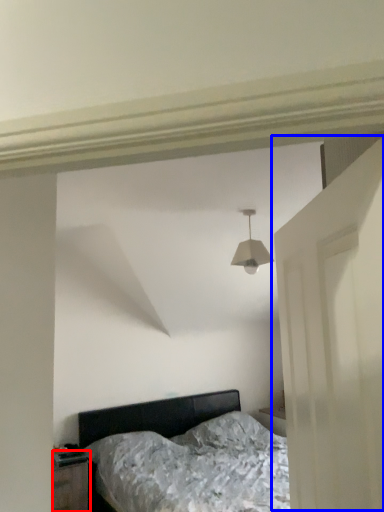
Question: Which object appears closest to the camera in this image, nightstand (highlighted by a red box) or door (highlighted by a blue box)?

Choices:
 (A) nightstand
 (B) door

Answer: (B)